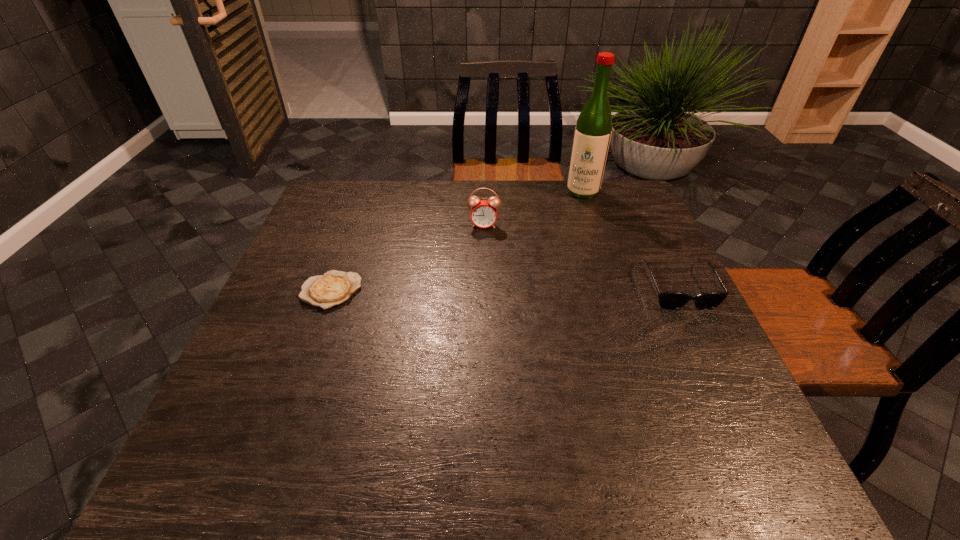
Locate an element on the screen. quiche is located at coordinates click(333, 288).

This screenshot has height=540, width=960. I want to click on the shortest object, so [333, 288].

Locate an element on the screen. This screenshot has height=540, width=960. the rightmost object is located at coordinates (667, 300).

Identify the location of the third tallest object. This screenshot has width=960, height=540. (667, 300).

This screenshot has width=960, height=540. I want to click on the third shortest object, so click(x=484, y=213).

I want to click on the third nearest object, so click(x=484, y=213).

Identify the location of the second object from right to left. Image resolution: width=960 pixels, height=540 pixels. (593, 129).

This screenshot has height=540, width=960. Find the location of `the farthest object`. the farthest object is located at coordinates (593, 129).

Locate an element on the screen. free spot located 0.350m on the right of the leftmost object is located at coordinates (502, 291).

I want to click on vacant space located at the front lenses of the sunglasses, so click(x=699, y=333).